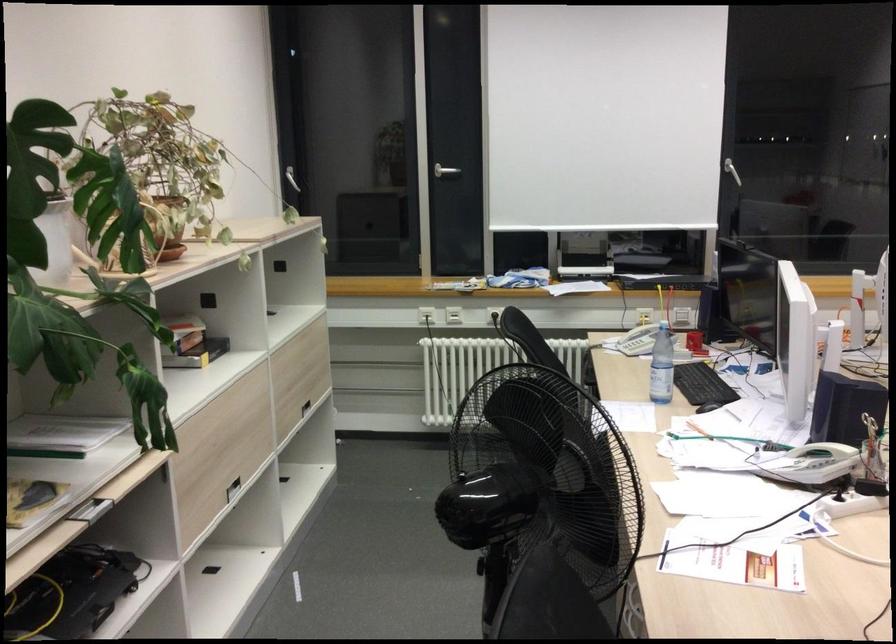
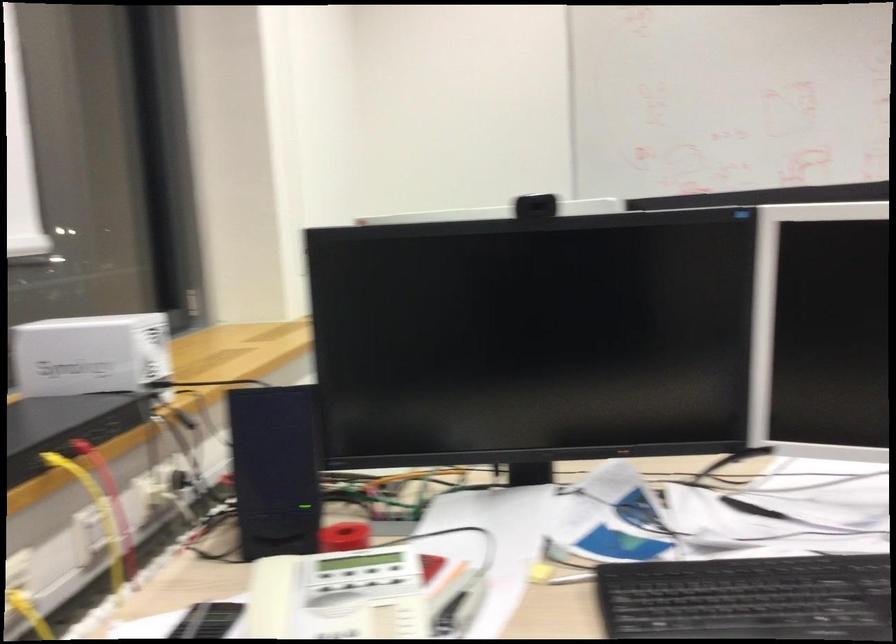
Locate, in the second image, the point that corresponds to [703,310] in the first image.

(274, 469)